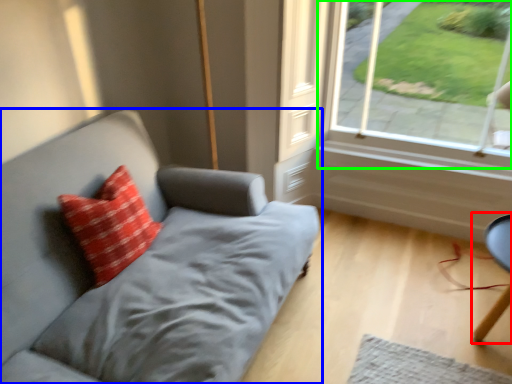
Question: Based on their relative distances, which object is farther from computer chair (highlighted by a red box)? Choose from studio couch (highlighted by a blue box) and window (highlighted by a green box).

Choices:
 (A) studio couch
 (B) window

Answer: (A)